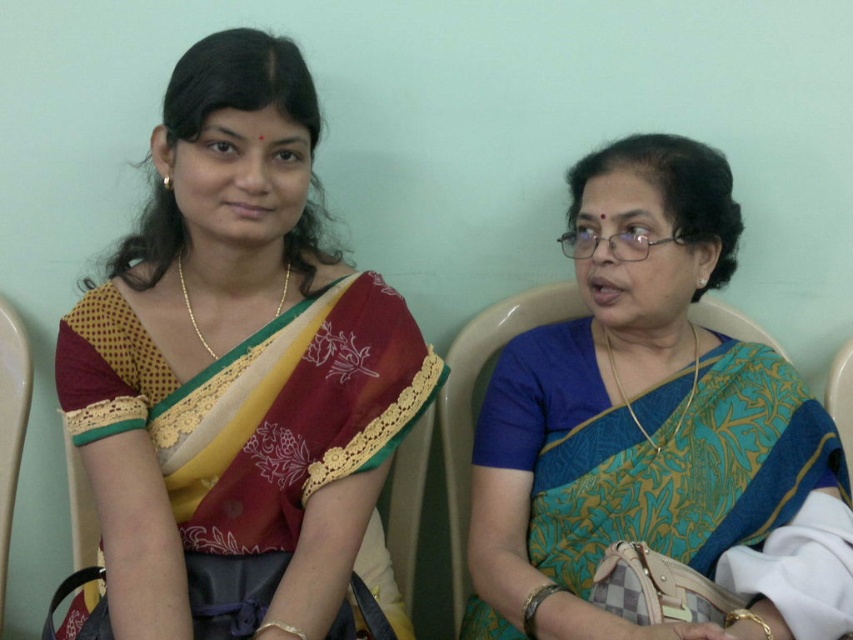
Question: Which object is closer to the camera taking this photo?

Choices:
 (A) matte plastic chair at left
 (B) blue silk saree at right

Answer: (B)

Question: Which object is positioned closest to the matte silk saree at left?

Choices:
 (A) matte plastic chair at left
 (B) blue silk saree at right

Answer: (B)

Question: Does matte silk saree at left appear under matte plastic chair at left?

Choices:
 (A) no
 (B) yes

Answer: (A)

Question: Which object is farther from the camera taking this photo?

Choices:
 (A) blue silk saree at right
 (B) matte plastic chair at left
 (C) matte silk saree at left

Answer: (B)

Question: Observing the image, what is the correct spatial positioning of blue silk saree at right in reference to matte plastic chair at left?

Choices:
 (A) right
 (B) left

Answer: (A)

Question: Considering the relative positions of matte silk saree at left and matte plastic chair at left in the image provided, where is matte silk saree at left located with respect to matte plastic chair at left?

Choices:
 (A) left
 (B) right

Answer: (B)